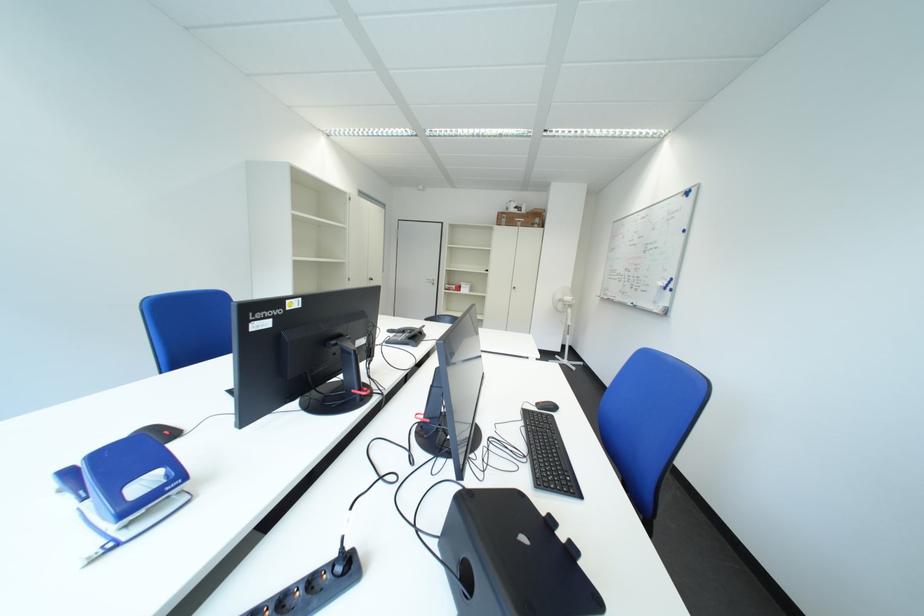
Describe the element at coordinates (431, 278) in the screenshot. The width and height of the screenshot is (924, 616). I see `a silver door handle` at that location.